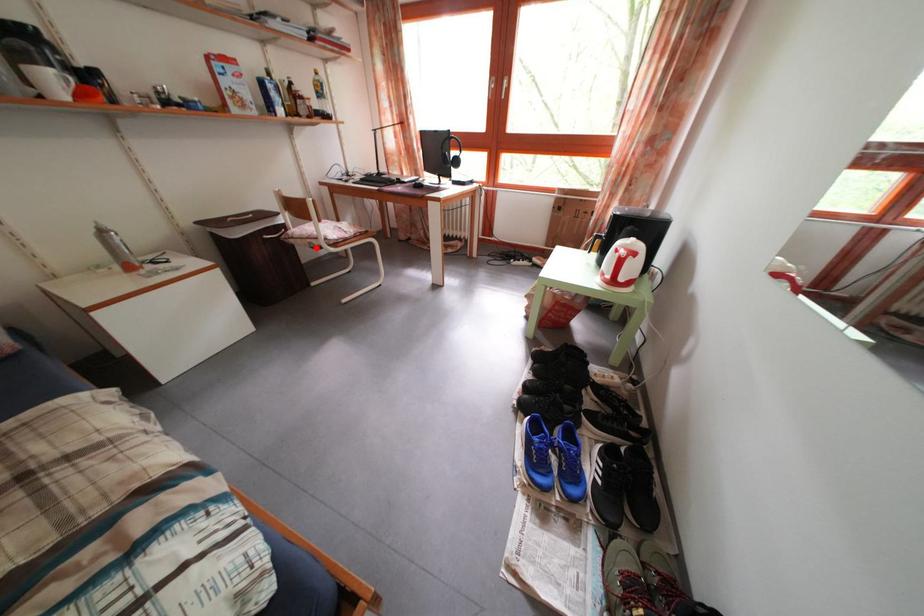
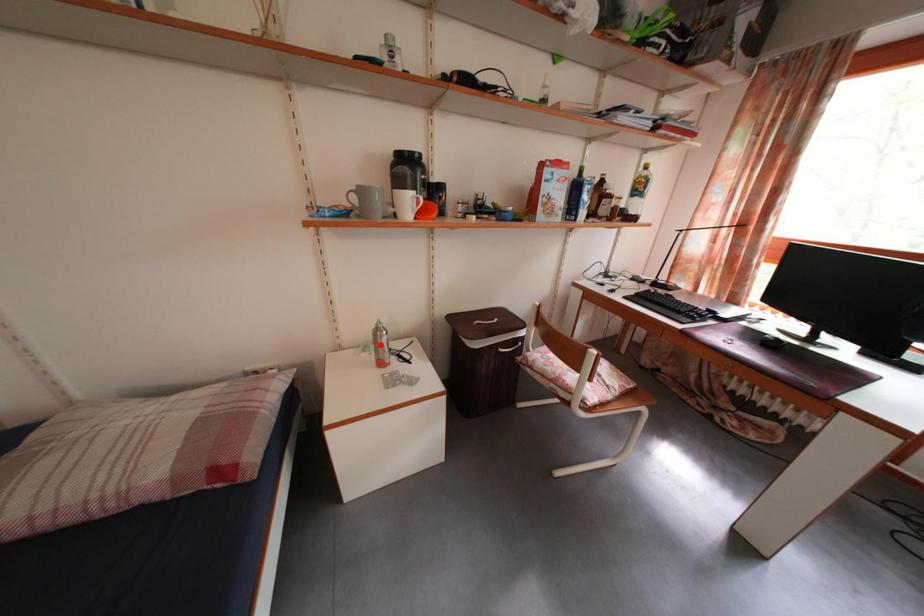
Looking at this image, I am providing you with two images of the same scene from different viewpoints. A red point is marked on the first image and another point is marked on the second image. Is the marked point in image1 the same physical position as the marked point in image2?

No